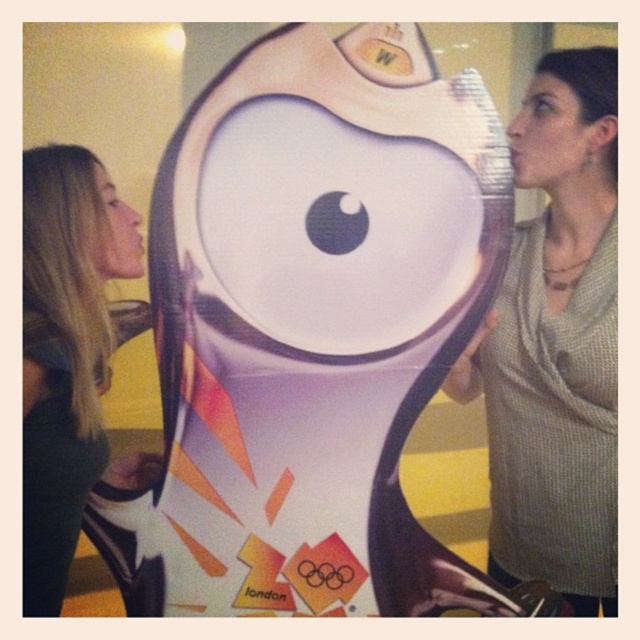
You are standing in front of the Olympic cutout and notice a specific point marked at coordinates point (556, 342). Based on the scene described, where exactly on the image would this point be located?

The point (556, 342) is located on the matte gray sweater at right.

Please provide the 2D coordinates of the matte gray sweater at right in the image. The coordinates should be in the format of a tuple with two decimal numbers between 0 and 1, where the first number represents the horizontal position and the second the vertical position. The origin is at the bottom left corner of the image. The image has a resolution of 1920x1080 pixels. The coordinates are normalized such that the full width is 1.0 and the full height is 1.0. The sweater is part of a scene featuring a cut.

The 2D coordinates of the matte gray sweater at right are at point (556, 342).

You are a photographer setting up for a group photo. You need to ensure that the distance between the matte gray sweater at right and the blonde hair at left is at least 36 inches to frame them properly. Based on the scene description, will the current positioning work?

The distance between the matte gray sweater at right and the blonde hair at left is 36.89 inches, which exceeds the required 36 inches. Therefore, the current positioning works for framing them properly.